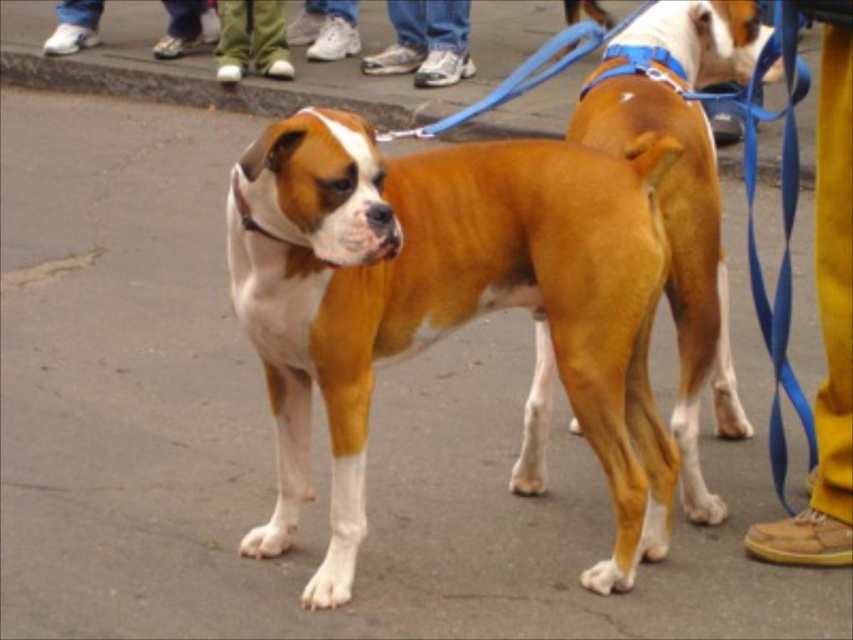
You are standing at the edge of a busy street and see a white leather shoe at lower center. You want to retrieve it without crossing the street. Can you reach it from your current position?

The white leather shoe at lower center is 6.96 meters away from viewer, so you cannot reach it without crossing the street.

You are a photographer setting up a tripod to capture the brown glossy dog at center and the white leather shoe at lower center. Since you want to ensure both subjects are in focus, which one should you adjust the focus on first based on their relative sizes?

The brown glossy dog at center is larger in size than the white leather shoe at lower center, so you should adjust the focus on the brown glossy dog at center first to ensure clarity given its prominence.